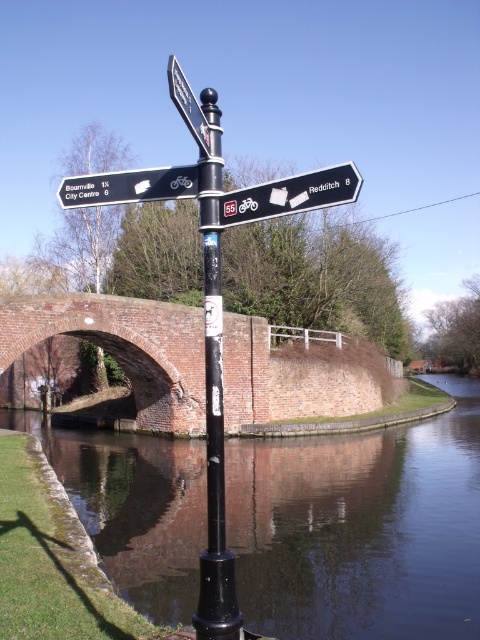
Question: Does smooth concrete river at center come behind matte black signpost at upper left?

Choices:
 (A) no
 (B) yes

Answer: (B)

Question: Is smooth concrete river at center positioned in front of metallic silver sign at upper center?

Choices:
 (A) no
 (B) yes

Answer: (A)

Question: Can you confirm if white plastic sign at upper right is positioned above matte black signpost at upper left?

Choices:
 (A) yes
 (B) no

Answer: (A)

Question: Which point is farther to the camera?

Choices:
 (A) white plastic sign at upper right
 (B) black metal pole at center

Answer: (B)

Question: Which point appears farthest from the camera in this image?

Choices:
 (A) (194, 136)
 (B) (113, 497)
 (C) (211, 570)
 (D) (137, 340)

Answer: (D)

Question: Which point is farther to the camera?

Choices:
 (A) matte black signpost at upper left
 (B) black metal pole at center
 (C) smooth concrete river at center

Answer: (C)